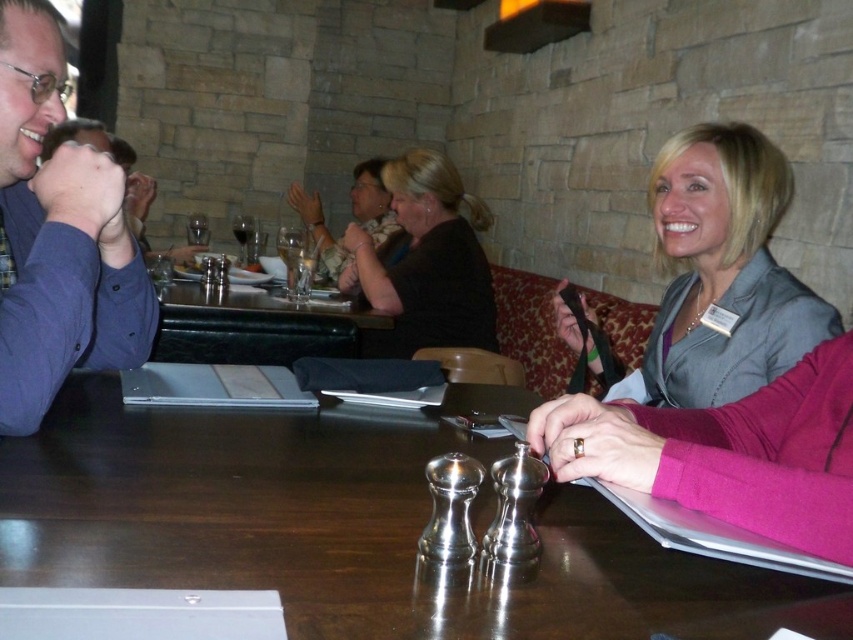
Which is above, wooden table at center or transparent glass at upper center?

transparent glass at upper center is higher up.

Measure the distance between wooden table at center and camera.

wooden table at center and camera are 2.32 meters apart.

This screenshot has width=853, height=640. I want to click on wooden table at center, so click(254, 324).

Can you confirm if metallic silver salt and pepper shakers at center is taller than matte black jacket at upper center?

No.

Who is more forward, (428, 496) or (392, 221)?

Point (428, 496)

What are the coordinates of `metallic silver salt and pepper shakers at center` in the screenshot? It's located at (347, 529).

Is metallic silver salt and pepper shakers at center taller than transparent glass at upper center?

No.

Between metallic silver salt and pepper shakers at center and transparent glass at upper center, which one has less height?

Standing shorter between the two is metallic silver salt and pepper shakers at center.

This screenshot has width=853, height=640. I want to click on metallic silver salt and pepper shakers at center, so click(x=347, y=529).

This screenshot has width=853, height=640. I want to click on metallic silver salt and pepper shakers at center, so click(347, 529).